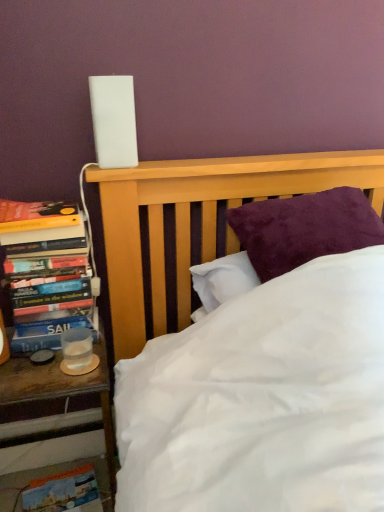
Question: Is wooden nightstand at left positioned behind clear plastic cup at left?

Choices:
 (A) no
 (B) yes

Answer: (A)

Question: Is wooden nightstand at left positioned far away from clear plastic cup at left?

Choices:
 (A) no
 (B) yes

Answer: (A)

Question: Considering the relative sizes of wooden nightstand at left and clear plastic cup at left in the image provided, is wooden nightstand at left thinner than clear plastic cup at left?

Choices:
 (A) yes
 (B) no

Answer: (B)

Question: Is wooden nightstand at left to the left of clear plastic cup at left from the viewer's perspective?

Choices:
 (A) yes
 (B) no

Answer: (A)

Question: From a real-world perspective, is wooden nightstand at left positioned over clear plastic cup at left based on gravity?

Choices:
 (A) no
 (B) yes

Answer: (A)

Question: From the image's perspective, is clear plastic cup at left above or below wooden nightstand at left?

Choices:
 (A) above
 (B) below

Answer: (A)

Question: Is clear plastic cup at left wider or thinner than wooden nightstand at left?

Choices:
 (A) thin
 (B) wide

Answer: (A)

Question: From a real-world perspective, relative to wooden nightstand at left, is clear plastic cup at left vertically above or below?

Choices:
 (A) above
 (B) below

Answer: (A)

Question: In the image, is clear plastic cup at left positioned in front of or behind wooden nightstand at left?

Choices:
 (A) front
 (B) behind

Answer: (B)

Question: From a real-world perspective, is hardcover books at left above or below clear plastic cup at left?

Choices:
 (A) above
 (B) below

Answer: (A)

Question: Is hardcover books at left in front of or behind clear plastic cup at left in the image?

Choices:
 (A) front
 (B) behind

Answer: (A)

Question: From the image's perspective, is hardcover books at left located above or below clear plastic cup at left?

Choices:
 (A) above
 (B) below

Answer: (A)

Question: In terms of height, does hardcover books at left look taller or shorter compared to clear plastic cup at left?

Choices:
 (A) tall
 (B) short

Answer: (A)

Question: From a real-world perspective, relative to wooden nightstand at left, is hardcover books at left vertically above or below?

Choices:
 (A) above
 (B) below

Answer: (A)

Question: Is hardcover books at left wider or thinner than wooden nightstand at left?

Choices:
 (A) thin
 (B) wide

Answer: (A)